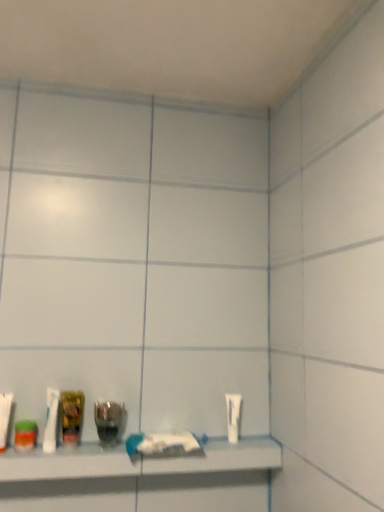
Question: Is white matte tube at right, which ranks as the 1th toiletry in back-to-front order, positioned before white plastic toothbrush at lower left, which appears as the first toiletry when viewed from the left?

Choices:
 (A) no
 (B) yes

Answer: (A)

Question: Considering the relative positions of white matte tube at right, marked as the 1th toiletry in a right-to-left arrangement, and white plastic toothbrush at lower left, which is the second toiletry in back-to-front order, in the image provided, is white matte tube at right, marked as the 1th toiletry in a right-to-left arrangement, to the right of white plastic toothbrush at lower left, which is the second toiletry in back-to-front order, from the viewer's perspective?

Choices:
 (A) yes
 (B) no

Answer: (A)

Question: Considering the relative sizes of white matte tube at right, the second toiletry in the left-to-right sequence, and white plastic toothbrush at lower left, which appears as the first toiletry when viewed from the left, in the image provided, is white matte tube at right, the second toiletry in the left-to-right sequence, shorter than white plastic toothbrush at lower left, which appears as the first toiletry when viewed from the left,?

Choices:
 (A) yes
 (B) no

Answer: (B)

Question: Can you see white matte tube at right, marked as the 1th toiletry in a right-to-left arrangement, touching white plastic toothbrush at lower left, which is the second toiletry in back-to-front order?

Choices:
 (A) yes
 (B) no

Answer: (B)

Question: From the image's perspective, is white matte tube at right, the second toiletry in the front-to-back sequence, below white plastic toothbrush at lower left, which is the 1th toiletry from front to back?

Choices:
 (A) yes
 (B) no

Answer: (A)

Question: In the image, is translucent plastic mouthwash at lower left, marked as the third mouthwash in a right-to-left arrangement, on the left side or the right side of white plastic toothbrush at lower left, which appears as the first toiletry when viewed from the left?

Choices:
 (A) right
 (B) left

Answer: (A)

Question: Is translucent plastic mouthwash at lower left, placed as the first mouthwash when sorted from left to right, situated inside white plastic toothbrush at lower left, which is the second toiletry in back-to-front order, or outside?

Choices:
 (A) outside
 (B) inside

Answer: (A)

Question: Looking at their shapes, would you say translucent plastic mouthwash at lower left, marked as the third mouthwash in a right-to-left arrangement, is wider or thinner than white plastic toothbrush at lower left, which is the 1th toiletry from front to back?

Choices:
 (A) thin
 (B) wide

Answer: (B)

Question: From the image's perspective, is translucent plastic mouthwash at lower left, placed as the first mouthwash when sorted from left to right, located above or below white plastic toothbrush at lower left, which is the 1th toiletry from front to back?

Choices:
 (A) below
 (B) above

Answer: (A)

Question: Based on their positions, is translucent plastic mouthwash at lower left, which appears as the 2th mouthwash when viewed from the right, located to the left or right of white plastic toothbrush at lower left, acting as the second toiletry starting from the right?

Choices:
 (A) right
 (B) left

Answer: (A)

Question: In the image, is translucent plastic mouthwash at lower left, which appears as the 2th mouthwash when viewed from the right, positioned in front of or behind white plastic toothbrush at lower left, acting as the second toiletry starting from the right?

Choices:
 (A) front
 (B) behind

Answer: (B)

Question: Which is correct: translucent plastic mouthwash at lower left, positioned as the 2th mouthwash in left-to-right order, is inside white plastic toothbrush at lower left, which is the second toiletry in back-to-front order, or outside of it?

Choices:
 (A) inside
 (B) outside

Answer: (B)

Question: Considering the positions of translucent plastic mouthwash at lower left, positioned as the 2th mouthwash in left-to-right order, and white plastic toothbrush at lower left, which appears as the first toiletry when viewed from the left, in the image, is translucent plastic mouthwash at lower left, positioned as the 2th mouthwash in left-to-right order, wider or thinner than white plastic toothbrush at lower left, which appears as the first toiletry when viewed from the left,?

Choices:
 (A) thin
 (B) wide

Answer: (B)

Question: From the image's perspective, relative to white matte tube at right, which ranks as the 1th toiletry in back-to-front order, is white plastic toothbrush at lower left, which is the second toiletry in back-to-front order, above or below?

Choices:
 (A) below
 (B) above

Answer: (B)

Question: Considering the positions of white plastic toothbrush at lower left, which appears as the first toiletry when viewed from the left, and white matte tube at right, the second toiletry in the left-to-right sequence, in the image, is white plastic toothbrush at lower left, which appears as the first toiletry when viewed from the left, bigger or smaller than white matte tube at right, the second toiletry in the left-to-right sequence,?

Choices:
 (A) big
 (B) small

Answer: (B)